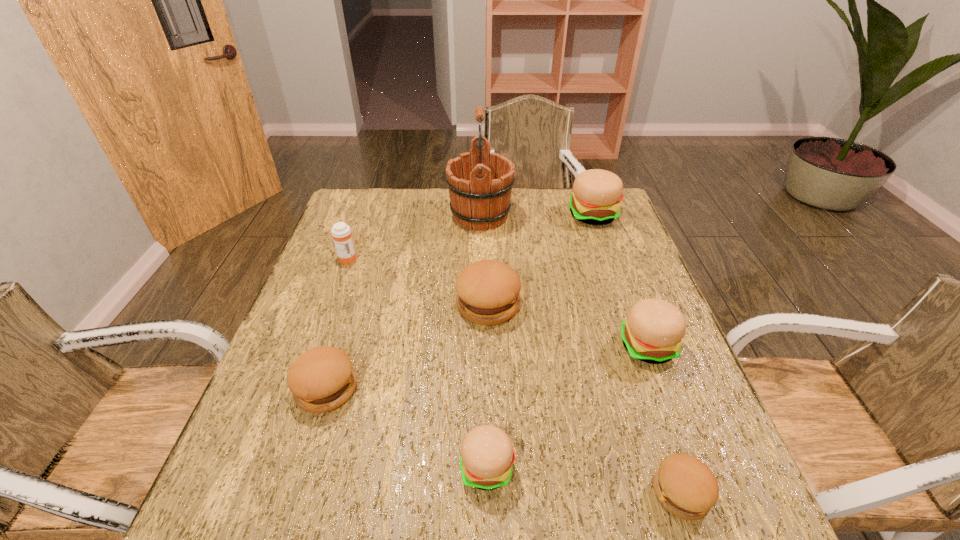
The image size is (960, 540). What are the coordinates of `beige hamburger identified as the closest to the second smallest beige hamburger` in the screenshot? It's located at (487, 455).

Locate which brown hamburger is the closest to the leftmost hamburger. Please provide its 2D coordinates. Your answer should be formatted as a tuple, i.e. [(x, y)], where the tuple contains the x and y coordinates of a point satisfying the conditions above.

[(488, 291)]

Choose which brown hamburger is the second nearest neighbor to the farthest brown hamburger. Please provide its 2D coordinates. Your answer should be formatted as a tuple, i.e. [(x, y)], where the tuple contains the x and y coordinates of a point satisfying the conditions above.

[(686, 487)]

Locate an element on the screen. vacant point that satisfies the following two spatial constraints: 1. on the front side of the shortest object; 2. on the left side of the biggest brown hamburger is located at coordinates (492, 492).

Locate an element on the screen. free location that satisfies the following two spatial constraints: 1. on the front side of the second farthest beige hamburger; 2. on the right side of the medicine is located at coordinates pos(315,346).

The height and width of the screenshot is (540, 960). What are the coordinates of `blank area in the image that satisfies the following two spatial constraints: 1. on the back side of the seventh shortest object; 2. on the left side of the nearest beige hamburger` in the screenshot? It's located at (484, 215).